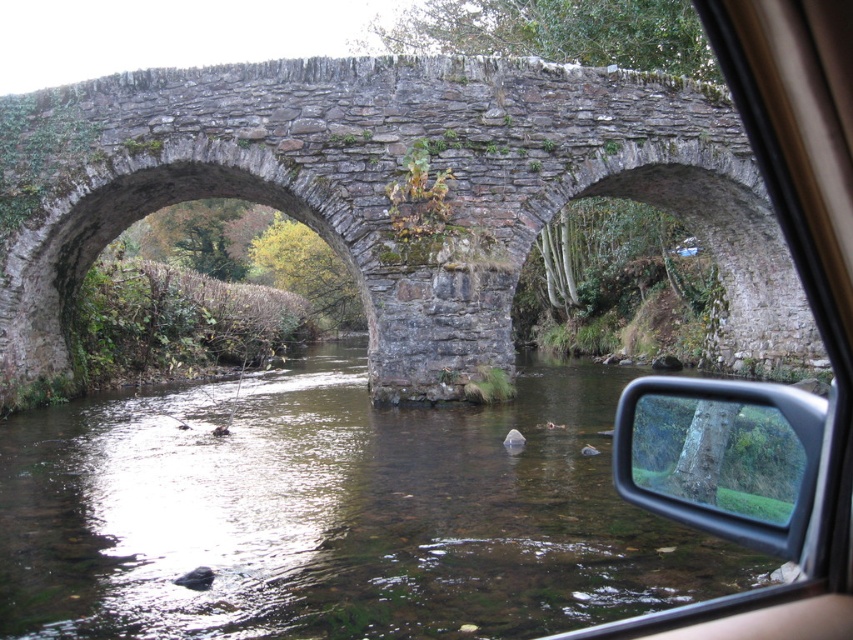
Looking at this image, you are a photographer inside a car and want to capture the rustic stone bridge at center and the clear water at center in your shot. Since you can only focus on one subject, which one should you choose if you want the closer subject to be in focus?

The clear water at center is positioned on the left side of rustic stone bridge at center, so you should focus on the clear water at center since it is closer to the camera.

You are driving a car and looking through the windshield. You see a rustic stone bridge at center and a transparent glass mirror at center. Which object is larger in your view?

The rustic stone bridge at center is bigger than the transparent glass mirror at center, so the rustic stone bridge at center appears larger in your view.